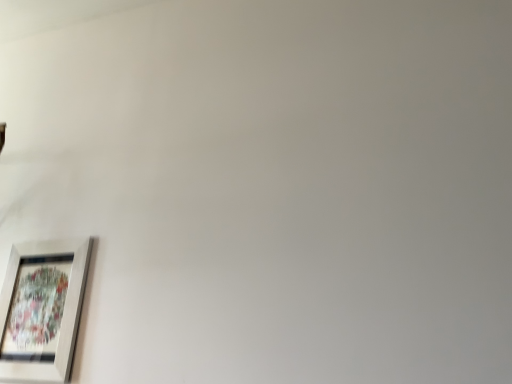
Question: Should I look upward or downward to see wooden picture frame at lower left?

Choices:
 (A) up
 (B) down

Answer: (B)